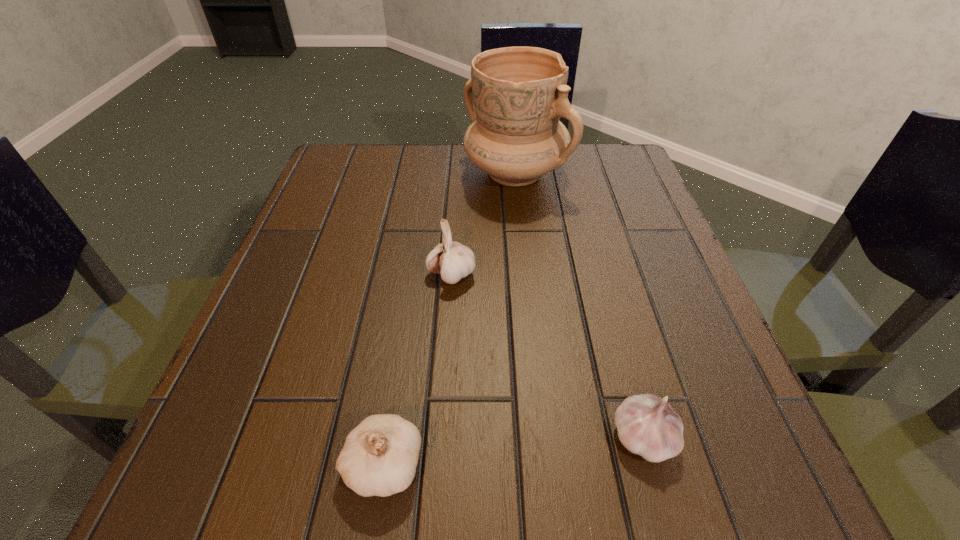
This screenshot has width=960, height=540. I want to click on vacant space that's between the rightmost garlic and the farthest garlic, so click(x=547, y=356).

Find the location of `unoccupied area between the farthest garlic and the pottery`. unoccupied area between the farthest garlic and the pottery is located at coordinates (484, 224).

Image resolution: width=960 pixels, height=540 pixels. Find the location of `free spot between the rightmost garlic and the farthest garlic`. free spot between the rightmost garlic and the farthest garlic is located at coordinates (547, 356).

Find the location of `free point between the second farthest object and the rightmost garlic`. free point between the second farthest object and the rightmost garlic is located at coordinates coord(547,356).

The image size is (960, 540). I want to click on object that is the second nearest to the farthest object, so click(x=647, y=425).

This screenshot has width=960, height=540. What are the coordinates of `the third closest object relative to the second farthest object` in the screenshot? It's located at (647, 425).

The width and height of the screenshot is (960, 540). In order to click on garlic that stands as the second closest to the farthest object in this screenshot , I will do `click(647, 425)`.

In order to click on the second closest garlic to the third nearest object in this screenshot , I will do `click(647, 425)`.

This screenshot has height=540, width=960. In order to click on free point that satisfies the following two spatial constraints: 1. on the front side of the pottery; 2. on the right side of the rightmost garlic in this screenshot , I will do `click(543, 437)`.

Identify the location of free space in the image that satisfies the following two spatial constraints: 1. on the front side of the rightmost garlic; 2. on the right side of the farthest object. (543, 437).